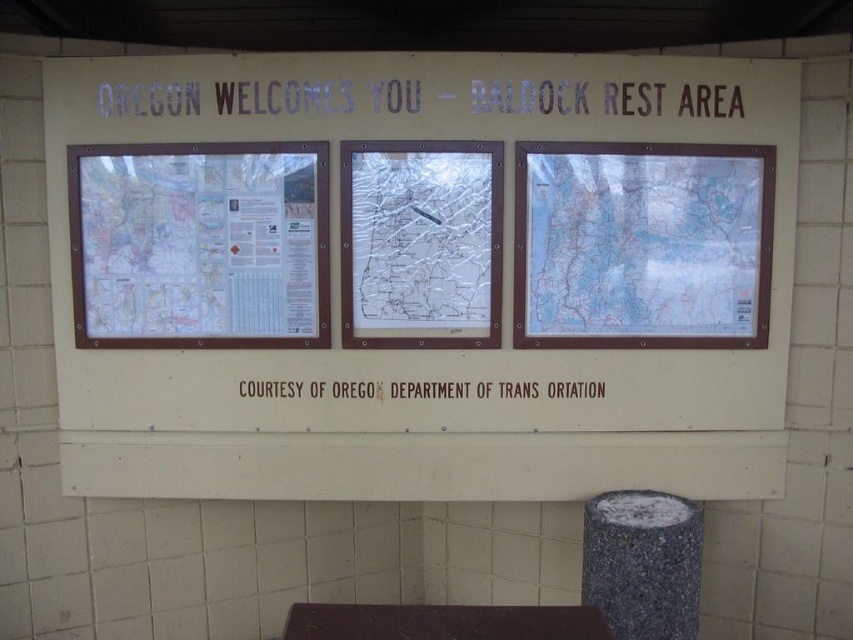
You are a tourist standing in front of the signboard. You notice the white plastic sign at upper center and the brown paper text at center. Which object is closer to you?

The white plastic sign at upper center is closer to you because it is in front of the brown paper text at center.

You are a tourist standing in front of the signboard. You want to read the white plastic sign at upper center and the brown paper text at center. Which one do you need to look up at more?

The white plastic sign at upper center has a greater height compared to brown paper text at center, so you need to look up more to read the white plastic sign at upper center.